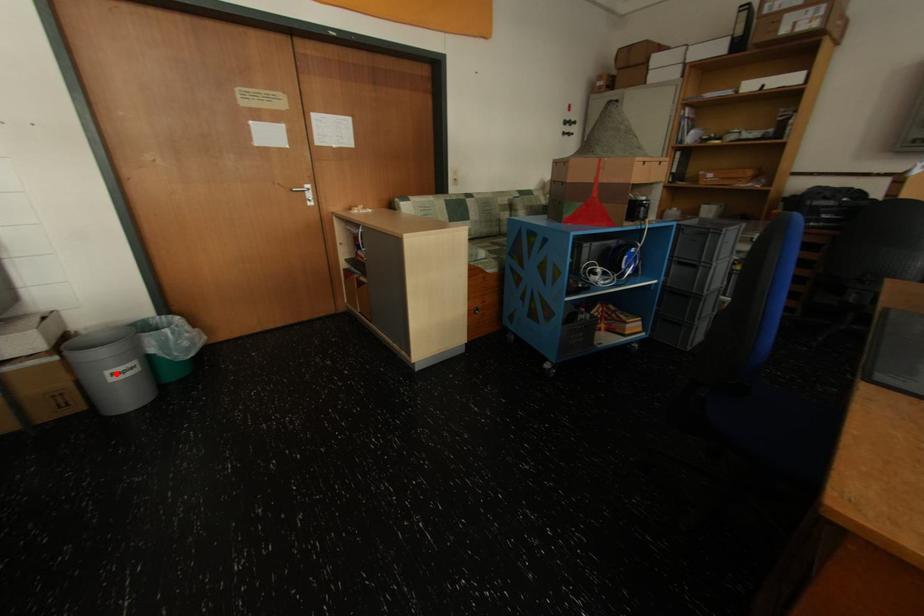
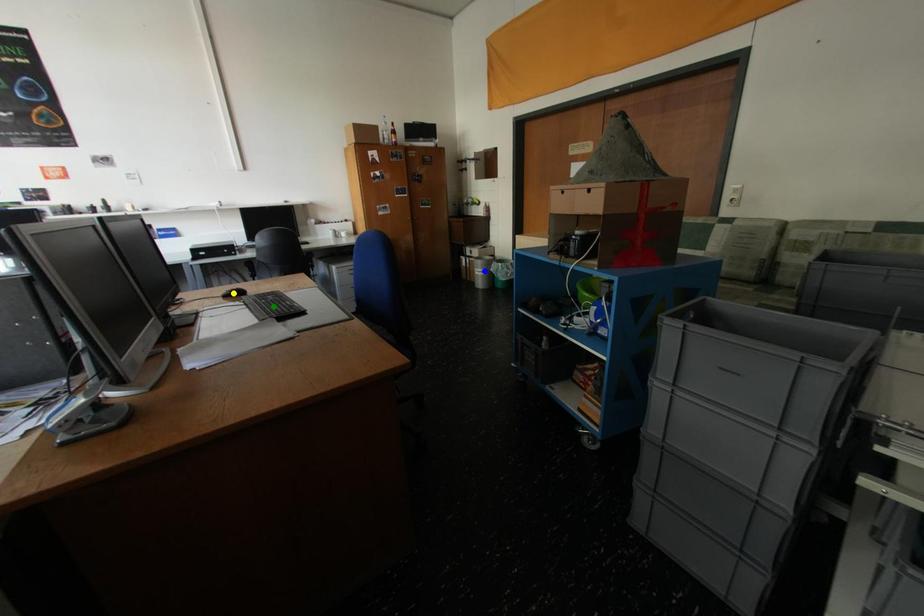
Question: I am providing you with two images of the same scene from different viewpoints. A red point is marked on the first image. You are given multiple points on the second image. In image 2, which mark is for the same physical point as the one in image 1?

Choices:
 (A) blue point
 (B) green point
 (C) yellow point

Answer: (A)